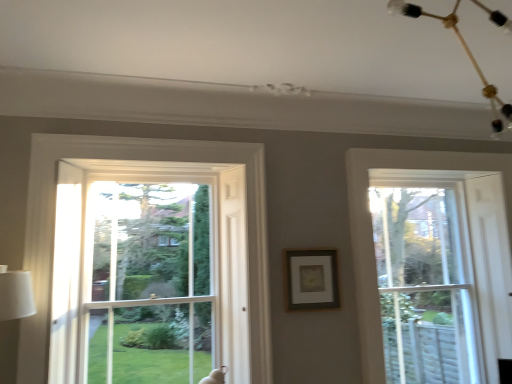
Question: Considering the relative sizes of matte gold picture frame at center and clear glass window screen at center in the image provided, is matte gold picture frame at center smaller than clear glass window screen at center?

Choices:
 (A) yes
 (B) no

Answer: (A)

Question: Is matte gold picture frame at center turned away from clear glass window screen at center?

Choices:
 (A) yes
 (B) no

Answer: (B)

Question: Considering the relative positions of matte gold picture frame at center and clear glass window screen at center in the image provided, is matte gold picture frame at center behind clear glass window screen at center?

Choices:
 (A) yes
 (B) no

Answer: (A)

Question: Is matte gold picture frame at center directly adjacent to clear glass window screen at center?

Choices:
 (A) no
 (B) yes

Answer: (A)

Question: Are matte gold picture frame at center and clear glass window screen at center located far from each other?

Choices:
 (A) no
 (B) yes

Answer: (B)

Question: Is point (170, 355) positioned closer to the camera than point (464, 48)?

Choices:
 (A) farther
 (B) closer

Answer: (A)

Question: Would you say clear glass window screen at center is inside or outside gold metallic chandelier at upper right?

Choices:
 (A) outside
 (B) inside

Answer: (A)

Question: From the image's perspective, is clear glass window screen at center located above or below gold metallic chandelier at upper right?

Choices:
 (A) below
 (B) above

Answer: (A)

Question: Considering the positions of clear glass window screen at center and gold metallic chandelier at upper right in the image, is clear glass window screen at center taller or shorter than gold metallic chandelier at upper right?

Choices:
 (A) short
 (B) tall

Answer: (B)

Question: In the image, is clear glass window screen at center on the left side or the right side of clear glass window at right?

Choices:
 (A) left
 (B) right

Answer: (A)

Question: In the image, is clear glass window screen at center positioned in front of or behind clear glass window at right?

Choices:
 (A) behind
 (B) front

Answer: (B)

Question: Is clear glass window screen at center wider or thinner than clear glass window at right?

Choices:
 (A) thin
 (B) wide

Answer: (B)

Question: Based on their sizes in the image, would you say clear glass window screen at center is bigger or smaller than clear glass window at right?

Choices:
 (A) small
 (B) big

Answer: (B)

Question: In terms of size, does gold metallic chandelier at upper right appear bigger or smaller than clear glass window screen at center?

Choices:
 (A) small
 (B) big

Answer: (A)

Question: Is gold metallic chandelier at upper right inside or outside of clear glass window screen at center?

Choices:
 (A) outside
 (B) inside

Answer: (A)